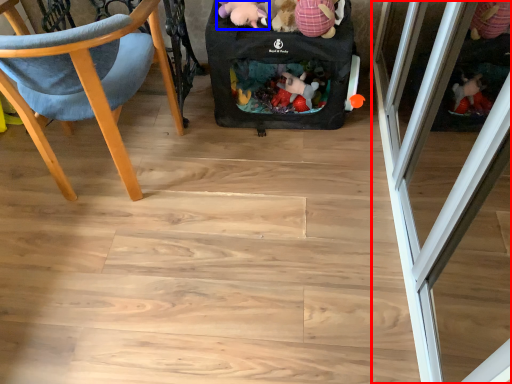
Question: Among these objects, which one is nearest to the camera, screen door (highlighted by a red box) or toy (highlighted by a blue box)?

Choices:
 (A) screen door
 (B) toy

Answer: (A)